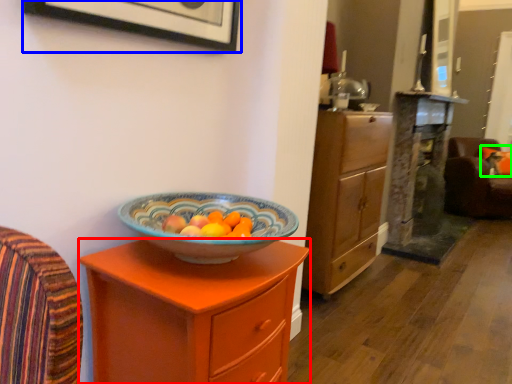
Question: Which object is the closest to the chest of drawers (highlighted by a red box)? Choose among these: picture frame (highlighted by a blue box) or pillow (highlighted by a green box).

Choices:
 (A) picture frame
 (B) pillow

Answer: (A)